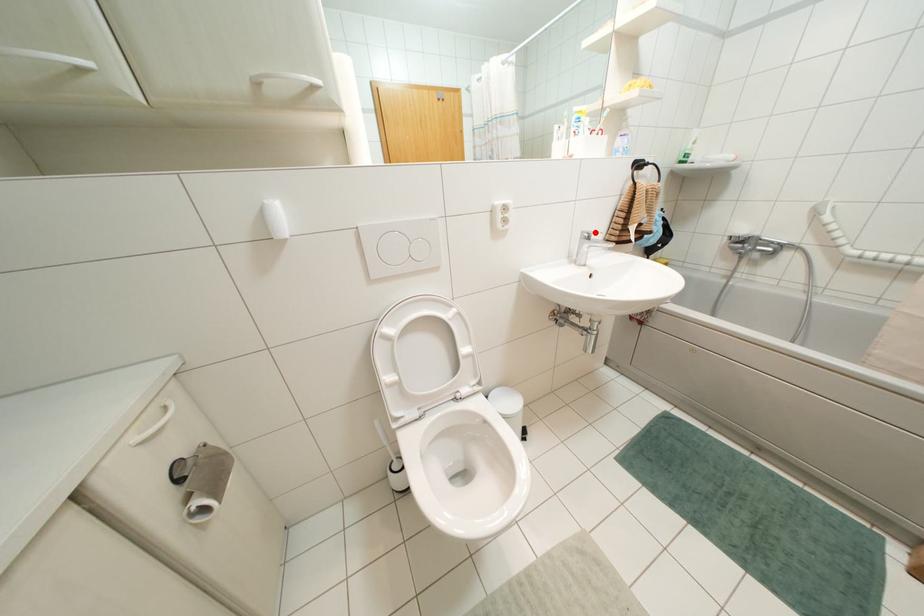
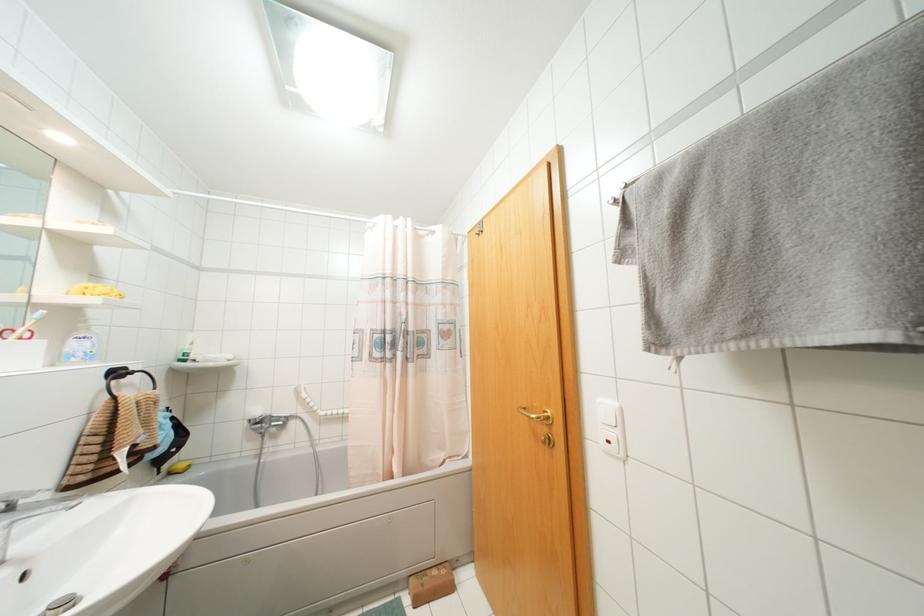
Question: I am providing you with two images of the same scene from different viewpoints. A red point is marked on the first image. Is the red point's position out of view in image 2?

Choices:
 (A) Yes
 (B) No

Answer: (B)